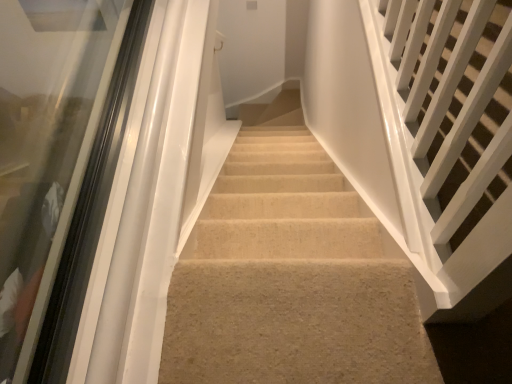
What is the approximate width of transparent glass door at left?

transparent glass door at left is 9.11 inches wide.

The width and height of the screenshot is (512, 384). Describe the element at coordinates (455, 104) in the screenshot. I see `white glossy rail at right, the second stairs in the left-to-right sequence` at that location.

I want to click on transparent glass door at left, so click(x=57, y=167).

Looking at their sizes, would you say white glossy rail at right, which is the 1th stairs from right to left, is wider or thinner than beige carpet at center, which is counted as the first stairs, starting from the left?

Considering their sizes, white glossy rail at right, which is the 1th stairs from right to left, looks slimmer than beige carpet at center, which is counted as the first stairs, starting from the left.

Based on the photo, would you consider white glossy rail at right, the second stairs in the left-to-right sequence, to be distant from beige carpet at center, which is counted as the first stairs, starting from the left?

A: white glossy rail at right, the second stairs in the left-to-right sequence, is actually quite close to beige carpet at center, which is counted as the first stairs, starting from the left.

Considering the sizes of objects white glossy rail at right, which is the 1th stairs from right to left, and beige carpet at center, the second stairs from the right, in the image provided, who is taller, white glossy rail at right, which is the 1th stairs from right to left, or beige carpet at center, the second stairs from the right,?

white glossy rail at right, which is the 1th stairs from right to left, is taller.

Is beige carpet at center, the second stairs from the right, positioned far away from transparent glass door at left?

That's not correct — beige carpet at center, the second stairs from the right, is a little close to transparent glass door at left.

How many degrees apart are the facing directions of beige carpet at center, which is counted as the first stairs, starting from the left, and transparent glass door at left?

The angular difference between beige carpet at center, which is counted as the first stairs, starting from the left, and transparent glass door at left is 90.2 degrees.

Considering the sizes of objects beige carpet at center, which is counted as the first stairs, starting from the left, and transparent glass door at left in the image provided, who is bigger, beige carpet at center, which is counted as the first stairs, starting from the left, or transparent glass door at left?

With larger size is transparent glass door at left.

Can we say beige carpet at center, the second stairs from the right, lies outside transparent glass door at left?

beige carpet at center, the second stairs from the right, is positioned outside transparent glass door at left.

Considering the sizes of objects transparent glass door at left and beige carpet at center, which is counted as the first stairs, starting from the left, in the image provided, who is shorter, transparent glass door at left or beige carpet at center, which is counted as the first stairs, starting from the left,?

With less height is beige carpet at center, which is counted as the first stairs, starting from the left.

Would you consider transparent glass door at left to be distant from beige carpet at center, the second stairs from the right?

No.

Does transparent glass door at left have a greater width compared to beige carpet at center, the second stairs from the right?

No, transparent glass door at left is not wider than beige carpet at center, the second stairs from the right.

Which is behind, point (61, 184) or point (205, 259)?

The point (61, 184) is behind.

Does transparent glass door at left turn towards white glossy rail at right, the second stairs in the left-to-right sequence?

Yes, transparent glass door at left is oriented towards white glossy rail at right, the second stairs in the left-to-right sequence.

From a real-world perspective, between transparent glass door at left and white glossy rail at right, the second stairs in the left-to-right sequence, who is vertically higher?

white glossy rail at right, the second stairs in the left-to-right sequence.

Considering the sizes of objects transparent glass door at left and white glossy rail at right, which is the 1th stairs from right to left, in the image provided, who is thinner, transparent glass door at left or white glossy rail at right, which is the 1th stairs from right to left,?

transparent glass door at left is thinner.

Considering the positions of objects transparent glass door at left and white glossy rail at right, which is the 1th stairs from right to left, in the image provided, who is more to the right, transparent glass door at left or white glossy rail at right, which is the 1th stairs from right to left,?

Positioned to the right is white glossy rail at right, which is the 1th stairs from right to left.

From a real-world perspective, relative to transparent glass door at left, is white glossy rail at right, which is the 1th stairs from right to left, vertically above or below?

In terms of real-world spatial position, white glossy rail at right, which is the 1th stairs from right to left, is above transparent glass door at left.

In the scene shown: Considering the relative sizes of white glossy rail at right, the second stairs in the left-to-right sequence, and transparent glass door at left in the image provided, is white glossy rail at right, the second stairs in the left-to-right sequence, smaller than transparent glass door at left?

Actually, white glossy rail at right, the second stairs in the left-to-right sequence, might be larger than transparent glass door at left.

Is white glossy rail at right, the second stairs in the left-to-right sequence, looking in the opposite direction of transparent glass door at left?

No, white glossy rail at right, the second stairs in the left-to-right sequence, is not facing the opposite direction of transparent glass door at left.

Is beige carpet at center, the second stairs from the right, wider than white glossy rail at right, the second stairs in the left-to-right sequence?

Indeed, beige carpet at center, the second stairs from the right, has a greater width compared to white glossy rail at right, the second stairs in the left-to-right sequence.

Can you confirm if beige carpet at center, the second stairs from the right, is taller than white glossy rail at right, which is the 1th stairs from right to left?

No.

Is beige carpet at center, which is counted as the first stairs, starting from the left, turned away from white glossy rail at right, which is the 1th stairs from right to left?

No, white glossy rail at right, which is the 1th stairs from right to left, is not at the back of beige carpet at center, which is counted as the first stairs, starting from the left.

Locate an element on the screen. This screenshot has width=512, height=384. stairs to the left of white glossy rail at right, which is the 1th stairs from right to left is located at coordinates (290, 279).

Locate an element on the screen. The image size is (512, 384). stairs that is the 1st one when counting rightward from the transparent glass door at left is located at coordinates (290, 279).

From the image, which object appears to be farther from transparent glass door at left, white glossy rail at right, the second stairs in the left-to-right sequence, or beige carpet at center, which is counted as the first stairs, starting from the left?

Among the two, white glossy rail at right, the second stairs in the left-to-right sequence, is located further to transparent glass door at left.

Estimate the real-world distances between objects in this image. Which object is closer to beige carpet at center, the second stairs from the right, transparent glass door at left or white glossy rail at right, the second stairs in the left-to-right sequence?

The object closer to beige carpet at center, the second stairs from the right, is white glossy rail at right, the second stairs in the left-to-right sequence.

Based on their spatial positions, is beige carpet at center, the second stairs from the right, or white glossy rail at right, the second stairs in the left-to-right sequence, further from transparent glass door at left?

white glossy rail at right, the second stairs in the left-to-right sequence, lies further to transparent glass door at left than the other object.

From the image, which object appears to be nearer to white glossy rail at right, which is the 1th stairs from right to left, beige carpet at center, the second stairs from the right, or transparent glass door at left?

beige carpet at center, the second stairs from the right, is positioned closer to the anchor white glossy rail at right, which is the 1th stairs from right to left.

From the image, which object appears to be farther from white glossy rail at right, the second stairs in the left-to-right sequence, transparent glass door at left or beige carpet at center, the second stairs from the right?

Based on the image, transparent glass door at left appears to be further to white glossy rail at right, the second stairs in the left-to-right sequence.

From the picture: Considering their positions, is white glossy rail at right, the second stairs in the left-to-right sequence, positioned closer to beige carpet at center, which is counted as the first stairs, starting from the left, than transparent glass door at left?

Among the two, white glossy rail at right, the second stairs in the left-to-right sequence, is located nearer to beige carpet at center, which is counted as the first stairs, starting from the left.

The image size is (512, 384). Find the location of `stairs situated between transparent glass door at left and white glossy rail at right, which is the 1th stairs from right to left, from left to right`. stairs situated between transparent glass door at left and white glossy rail at right, which is the 1th stairs from right to left, from left to right is located at coordinates (290, 279).